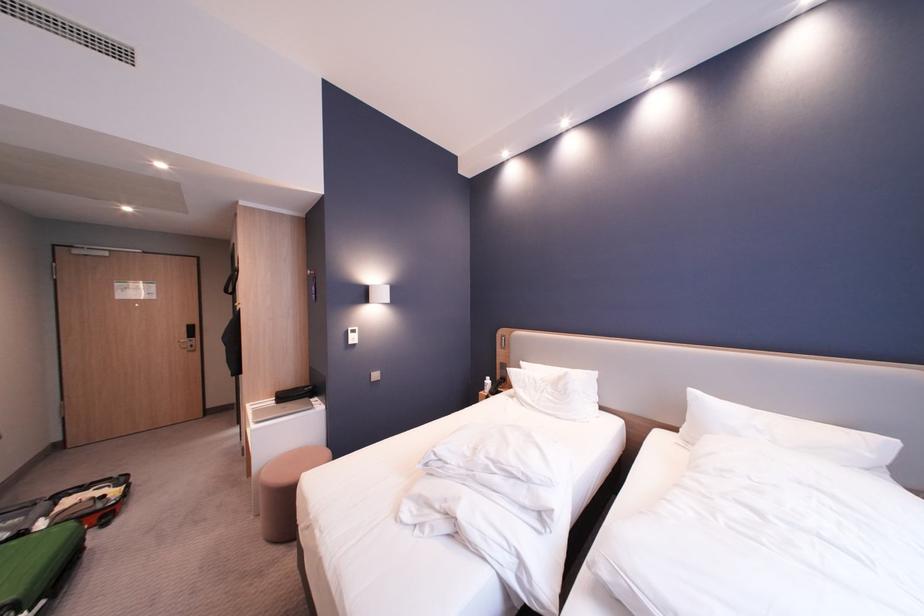
The image size is (924, 616). Describe the element at coordinates (285, 490) in the screenshot. I see `the pink stool` at that location.